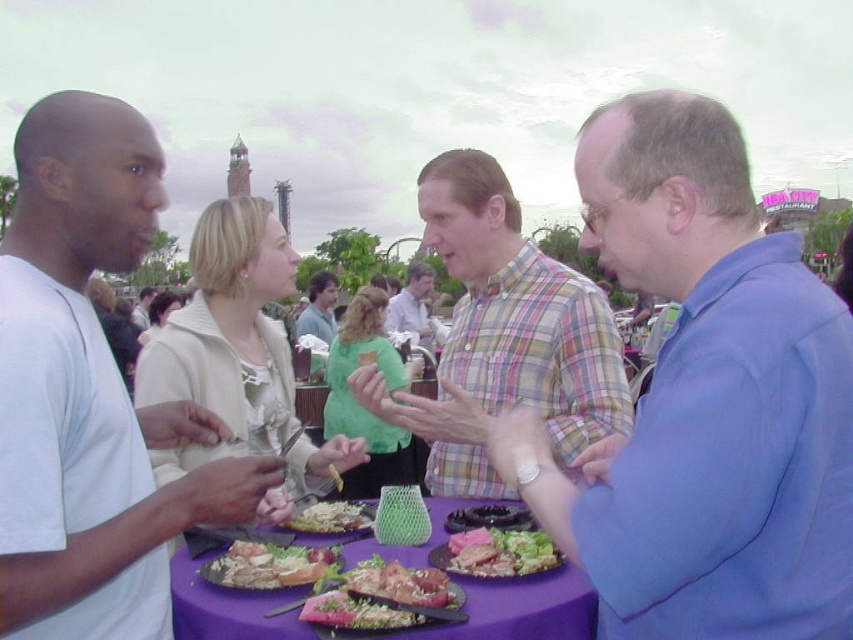
Question: Among these objects, which one is nearest to the camera?

Choices:
 (A) shiny plastic fork at lower center
 (B) crumbly bread at center
 (C) purple fabric table at center

Answer: (C)

Question: Can you confirm if purple fabric table at center is positioned above white crumbly bread at center?

Choices:
 (A) no
 (B) yes

Answer: (A)

Question: Is blue cotton shirt at right to the left of smooth pinkish-red sandwich at center from the viewer's perspective?

Choices:
 (A) no
 (B) yes

Answer: (A)

Question: Is smooth pinkish-red sandwich at center above plaid cotton shirt at center?

Choices:
 (A) yes
 (B) no

Answer: (B)

Question: Which point appears closest to the camera in this image?

Choices:
 (A) (426, 292)
 (B) (467, 154)

Answer: (B)

Question: Which is farther from the shiny plastic fork at lower center?

Choices:
 (A) purple fabric table at center
 (B) plaid cotton shirt at center

Answer: (B)